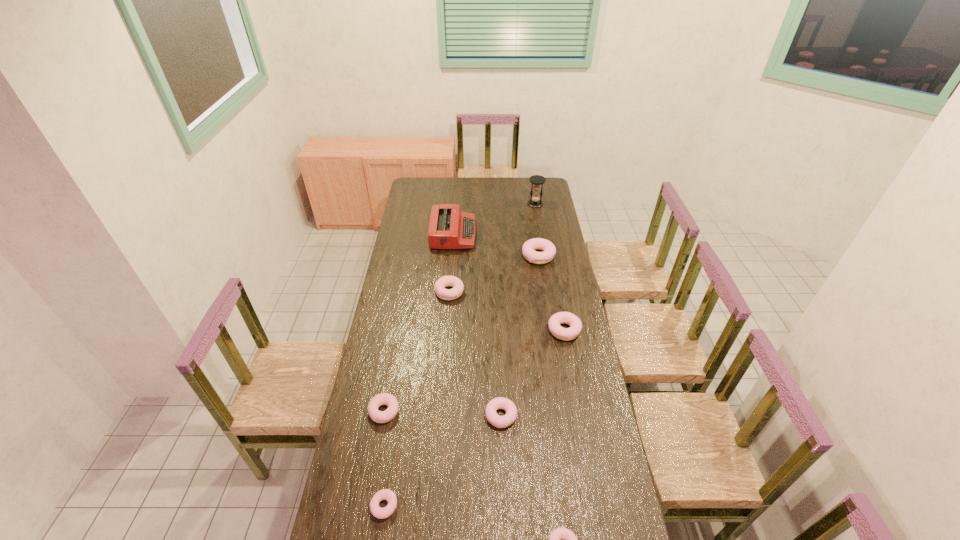
Find the location of a particular element. Image resolution: width=960 pixels, height=540 pixels. empty space between the hourglass and the third nearest pink doughnut is located at coordinates (550, 267).

Identify the location of vacant space in between the second biggest purple doughnut and the red typewriter. (419, 322).

The width and height of the screenshot is (960, 540). What are the coordinates of `free spot between the third doughnut from left to right and the leftmost pink doughnut` in the screenshot? It's located at (475, 354).

Identify the location of free space between the second nearest pink doughnut and the smallest purple doughnut. This screenshot has height=540, width=960. (443, 461).

Identify the location of empty space between the fifth object from right to left and the fifth farthest object. Image resolution: width=960 pixels, height=540 pixels. (533, 373).

Where is `unoccupied area between the second farthest purple doughnut and the rightmost purple doughnut`? unoccupied area between the second farthest purple doughnut and the rightmost purple doughnut is located at coordinates (417, 351).

At what (x,y) coordinates should I click in order to perform the action: click on object that can be found as the third closest to the typewriter. Please return your answer as a coordinate pair (x, y). The height and width of the screenshot is (540, 960). Looking at the image, I should click on (535, 202).

Where is `the second closest object to the third farthest pink doughnut`? the second closest object to the third farthest pink doughnut is located at coordinates (566, 334).

At what (x,y) coordinates should I click in order to perform the action: click on the fifth closest doughnut to the third biggest pink doughnut. Please return your answer as a coordinate pair (x, y). Looking at the image, I should click on (445, 281).

The height and width of the screenshot is (540, 960). In order to click on the fourth closest doughnut relative to the second nearest purple doughnut in this screenshot , I will do `click(569, 539)`.